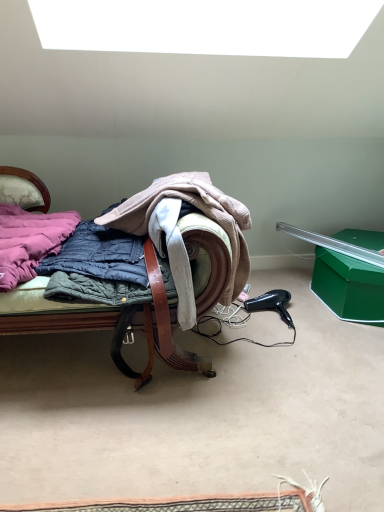
Question: In the image, is pink quilted jacket at left positioned in front of or behind quilted fabric coat at center?

Choices:
 (A) behind
 (B) front

Answer: (B)

Question: Considering the positions of point (34, 231) and point (99, 222), is point (34, 231) closer or farther from the camera than point (99, 222)?

Choices:
 (A) closer
 (B) farther

Answer: (A)

Question: Estimate the real-world distances between objects in this image. Which object is farther from the quilted fabric chair at center?

Choices:
 (A) black plastic hair dryer at lower right
 (B) quilted fabric coat at center
 (C) pink quilted jacket at left

Answer: (A)

Question: Which is farther from the quilted fabric coat at center?

Choices:
 (A) quilted fabric chair at center
 (B) pink quilted jacket at left
 (C) black plastic hair dryer at lower right

Answer: (C)